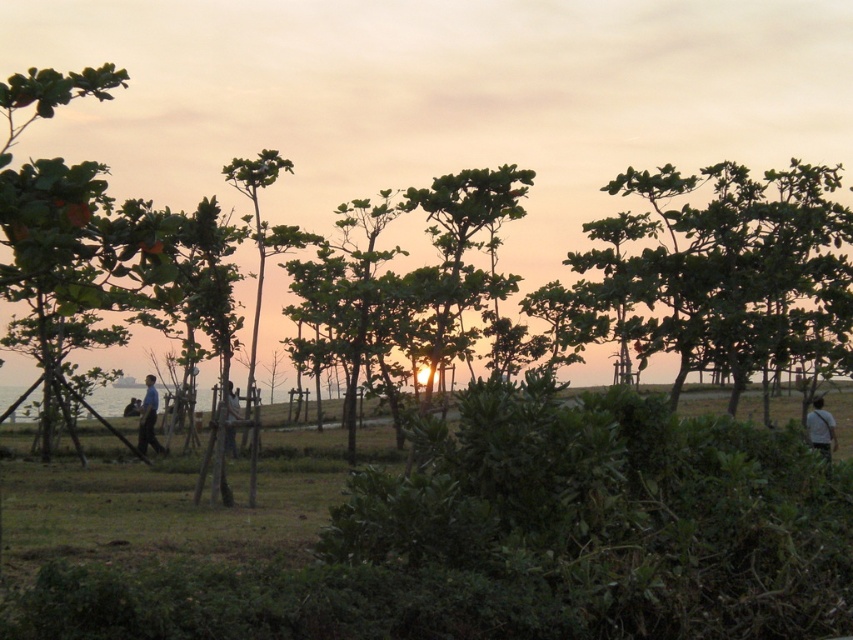
You are a photographer standing at the edge of the grassy area aiming to capture the blue fabric shirt at center and dark blue jeans at center in the same frame. Based on their distance apart, can you fit both subjects into your camera frame without moving closer or farther away?

The blue fabric shirt at center and dark blue jeans at center are 3.77 meters apart. Since the distance between them is significant, it might be challenging to fit both into the camera frame without adjusting your position. Consider moving closer to ensure both subjects are within the frame.

You are standing in the grassy area and see two people wearing the light brown fabric shirt at lower right and the blue fabric shirt at center. Which person is positioned more to the east if the sun is setting in the west?

The light brown fabric shirt at lower right is to the right of the blue fabric shirt at center. Since the sun is setting in the west, the right side of the image corresponds to the east. Therefore, the person wearing the light brown fabric shirt at lower right is positioned more to the east.